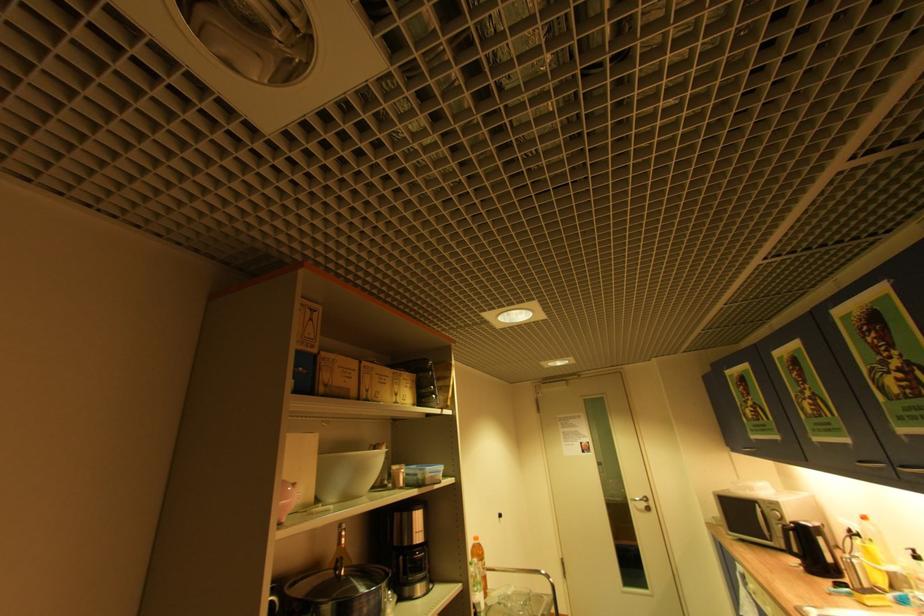
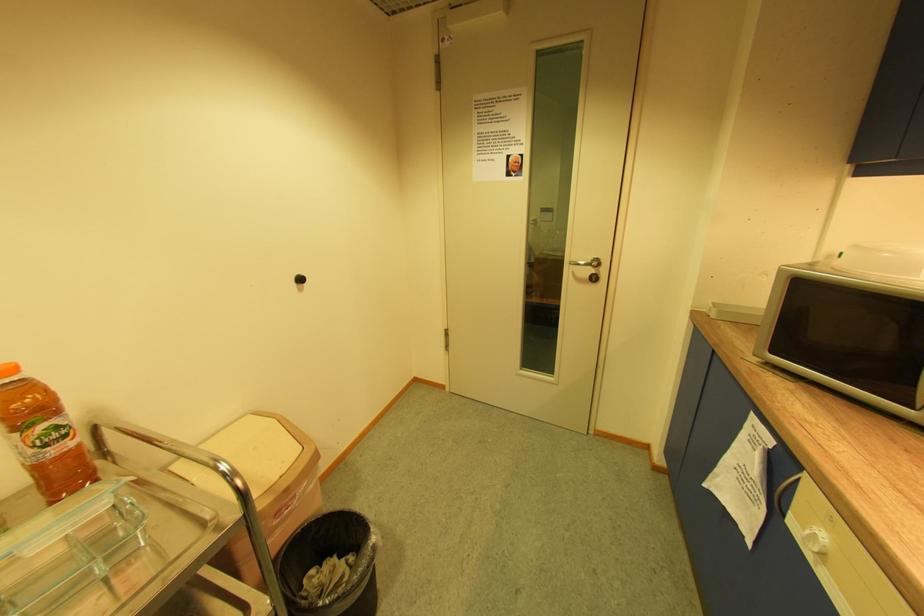
Where in the second image is the point corresponding to (736,491) from the first image?

(845, 265)